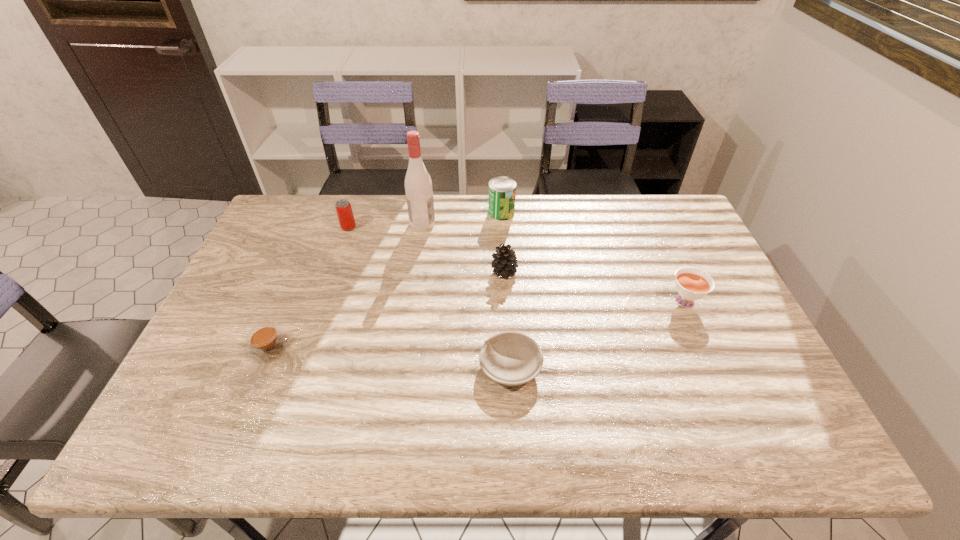
Locate an element on the screen. can located in the far edge section of the desktop is located at coordinates (502, 190).

At what (x,y) coordinates should I click in order to perform the action: click on beer can that is at the far edge. Please return your answer as a coordinate pair (x, y). The width and height of the screenshot is (960, 540). Looking at the image, I should click on (343, 207).

Identify the location of object positioned at the left edge. The height and width of the screenshot is (540, 960). (266, 343).

Where is `object located at the right edge`? The width and height of the screenshot is (960, 540). object located at the right edge is located at coordinates (691, 285).

Where is `free region at the far edge of the desktop`? The image size is (960, 540). free region at the far edge of the desktop is located at coordinates (407, 225).

Find the location of `vacant space at the near edge of the desktop`. vacant space at the near edge of the desktop is located at coordinates (353, 429).

In order to click on vacant space at the left edge in this screenshot , I will do pos(253,276).

At what (x,y) coordinates should I click in order to perform the action: click on vacant region at the right edge. Please return your answer as a coordinate pair (x, y). Looking at the image, I should click on (673, 246).

At what (x,y) coordinates should I click in order to perform the action: click on vacant space at the far right corner. Please return your answer as a coordinate pair (x, y). Image resolution: width=960 pixels, height=540 pixels. Looking at the image, I should click on (657, 220).

At what (x,y) coordinates should I click in order to perform the action: click on free point between the fifth object from right to left and the shortest object. Please return your answer as a coordinate pair (x, y). Looking at the image, I should click on (467, 295).